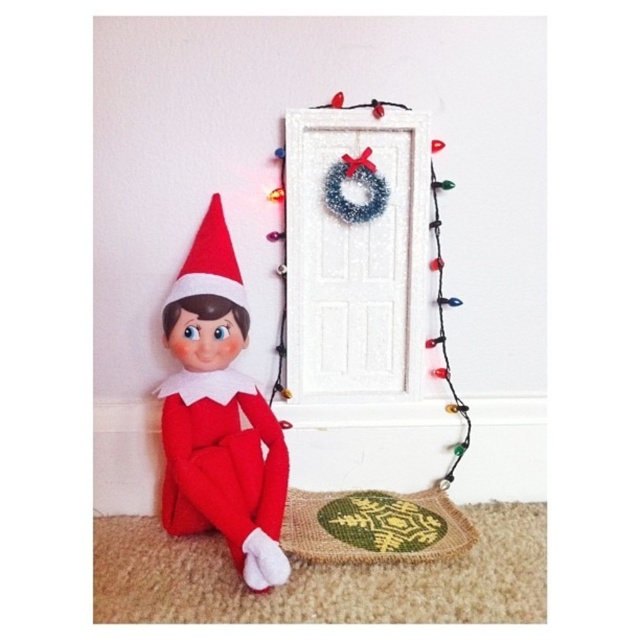
Does multicolored string lights at upper center have a greater width compared to green woven mat at lower center?

Indeed, multicolored string lights at upper center has a greater width compared to green woven mat at lower center.

The width and height of the screenshot is (640, 640). What do you see at coordinates (342, 253) in the screenshot? I see `multicolored string lights at upper center` at bounding box center [342, 253].

Find the location of a particular element. multicolored string lights at upper center is located at coordinates (342, 253).